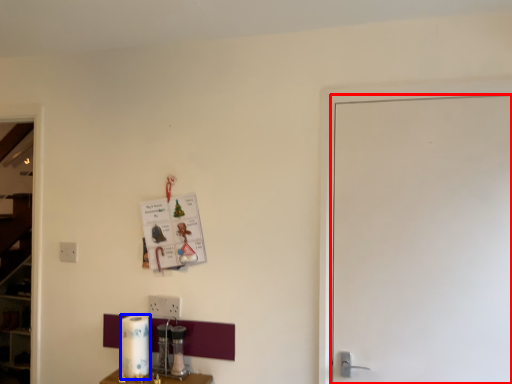
Question: Which object appears farthest to the camera in this image, door (highlighted by a red box) or paper towel (highlighted by a blue box)?

Choices:
 (A) door
 (B) paper towel

Answer: (B)